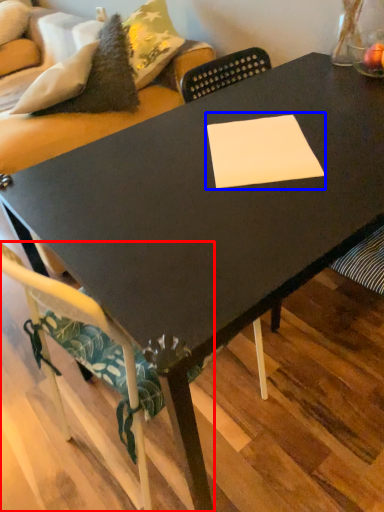
Question: Among these objects, which one is farthest to the camera, chair (highlighted by a red box) or rectangle (highlighted by a blue box)?

Choices:
 (A) chair
 (B) rectangle

Answer: (B)